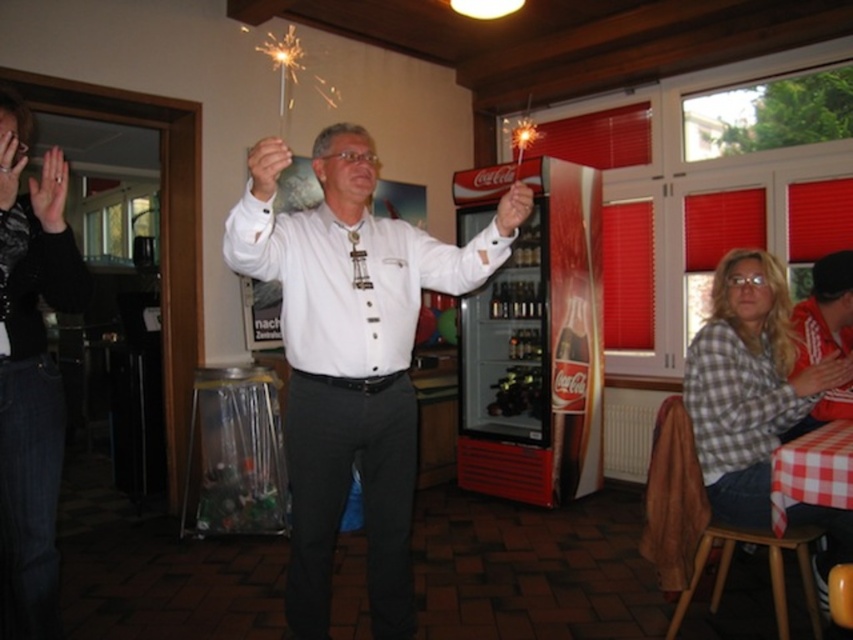
Does point (392, 540) come farther from viewer compared to point (701, 397)?

That is False.

Is white matte shirt at center bigger than checkered fabric shirt at lower right?

Yes, white matte shirt at center is bigger than checkered fabric shirt at lower right.

Between point (310, 349) and point (741, 422), which one is positioned in front?

Positioned in front is point (310, 349).

Identify the location of white matte shirt at center. This screenshot has height=640, width=853. (351, 356).

Can you confirm if white matte shirt at center is positioned below black textured sweater at left?

Yes, white matte shirt at center is below black textured sweater at left.

Does white matte shirt at center appear on the right side of black textured sweater at left?

Indeed, white matte shirt at center is positioned on the right side of black textured sweater at left.

This screenshot has width=853, height=640. Find the location of `white matte shirt at center`. white matte shirt at center is located at coordinates (351, 356).

Between black textured sweater at left and checkered fabric shirt at lower right, which one appears on the right side from the viewer's perspective?

checkered fabric shirt at lower right

Between black textured sweater at left and checkered fabric shirt at lower right, which one has more height?

black textured sweater at left is taller.

Between point (9, 456) and point (838, 378), which one is positioned in front?

Point (9, 456)

Locate an element on the screen. black textured sweater at left is located at coordinates (32, 374).